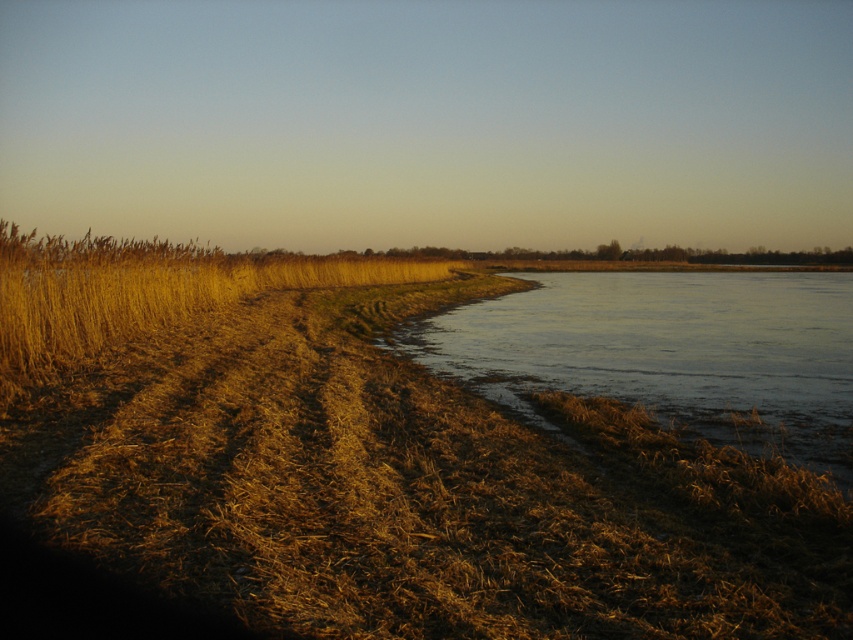
Is point (10, 358) farther from camera compared to point (21, 349)?

That is False.

Is dry grass at left positioned behind golden dry grass at left?

No, it is not.

The width and height of the screenshot is (853, 640). Describe the element at coordinates (374, 465) in the screenshot. I see `dry grass at left` at that location.

Find the location of a particular element. dry grass at left is located at coordinates (374, 465).

Is dry grass at left positioned at the back of frozen ice at lower right?

No.

Who is more forward, (780, 593) or (415, 348)?

Point (780, 593)

Identify the location of dry grass at left. (374, 465).

This screenshot has width=853, height=640. In order to click on dry grass at left in this screenshot , I will do `click(374, 465)`.

Does frozen ice at lower right appear under golden dry grass at left?

Yes.

Can you confirm if frozen ice at lower right is positioned to the right of golden dry grass at left?

Yes, frozen ice at lower right is to the right of golden dry grass at left.

Is point (445, 342) closer to viewer compared to point (126, 296)?

No, it is behind (126, 296).

Find the location of `frozen ice at lower right`. frozen ice at lower right is located at coordinates (670, 353).